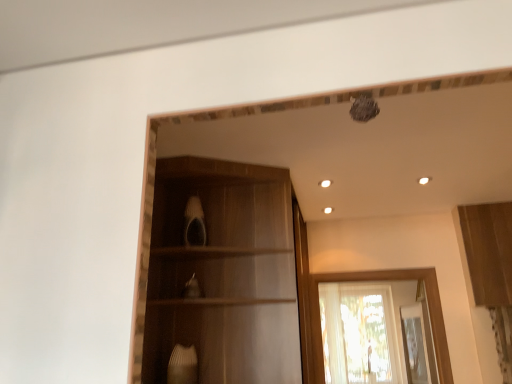
Question: Which direction should I rotate to look at wooden cabinet at center, the first cabinetry positioned from the left?

Choices:
 (A) right
 (B) left

Answer: (B)

Question: Is translucent fabric window at center not near wooden cabinet at upper right, the 1th cabinetry when ordered from right to left?

Choices:
 (A) no
 (B) yes

Answer: (B)

Question: Can you confirm if translucent fabric window at center is positioned to the left of wooden cabinet at upper right, the 1th cabinetry when ordered from right to left?

Choices:
 (A) no
 (B) yes

Answer: (B)

Question: From a real-world perspective, is translucent fabric window at center below wooden cabinet at upper right, the 1th cabinetry when ordered from right to left?

Choices:
 (A) yes
 (B) no

Answer: (A)

Question: From the image's perspective, does translucent fabric window at center appear higher than wooden cabinet at upper right, the second cabinetry in the left-to-right sequence?

Choices:
 (A) yes
 (B) no

Answer: (B)

Question: Considering the relative sizes of translucent fabric window at center and wooden cabinet at upper right, the second cabinetry in the left-to-right sequence, in the image provided, is translucent fabric window at center smaller than wooden cabinet at upper right, the second cabinetry in the left-to-right sequence,?

Choices:
 (A) no
 (B) yes

Answer: (A)

Question: From a real-world perspective, is translucent fabric window at center on wooden cabinet at upper right, the 1th cabinetry when ordered from right to left?

Choices:
 (A) no
 (B) yes

Answer: (A)

Question: Is wooden cabinet at center, the 2th cabinetry when ordered from right to left, far away from wooden cabinet at upper right, the second cabinetry in the left-to-right sequence?

Choices:
 (A) no
 (B) yes

Answer: (B)

Question: From a real-world perspective, is wooden cabinet at center, the first cabinetry positioned from the left, beneath wooden cabinet at upper right, the 1th cabinetry when ordered from right to left?

Choices:
 (A) yes
 (B) no

Answer: (A)

Question: Is wooden cabinet at center, the first cabinetry positioned from the left, outside wooden cabinet at upper right, the second cabinetry in the left-to-right sequence?

Choices:
 (A) yes
 (B) no

Answer: (A)

Question: Is wooden cabinet at center, the 2th cabinetry when ordered from right to left, next to wooden cabinet at upper right, the 1th cabinetry when ordered from right to left?

Choices:
 (A) no
 (B) yes

Answer: (A)

Question: Is wooden cabinet at center, the first cabinetry positioned from the left, further to camera compared to wooden cabinet at upper right, the second cabinetry in the left-to-right sequence?

Choices:
 (A) no
 (B) yes

Answer: (A)

Question: From the image's perspective, does wooden cabinet at center, the 2th cabinetry when ordered from right to left, appear lower than wooden cabinet at upper right, the 1th cabinetry when ordered from right to left?

Choices:
 (A) no
 (B) yes

Answer: (B)

Question: Considering the relative sizes of translucent fabric window at center and wooden cabinet at center, the 2th cabinetry when ordered from right to left, in the image provided, is translucent fabric window at center thinner than wooden cabinet at center, the 2th cabinetry when ordered from right to left,?

Choices:
 (A) yes
 (B) no

Answer: (A)